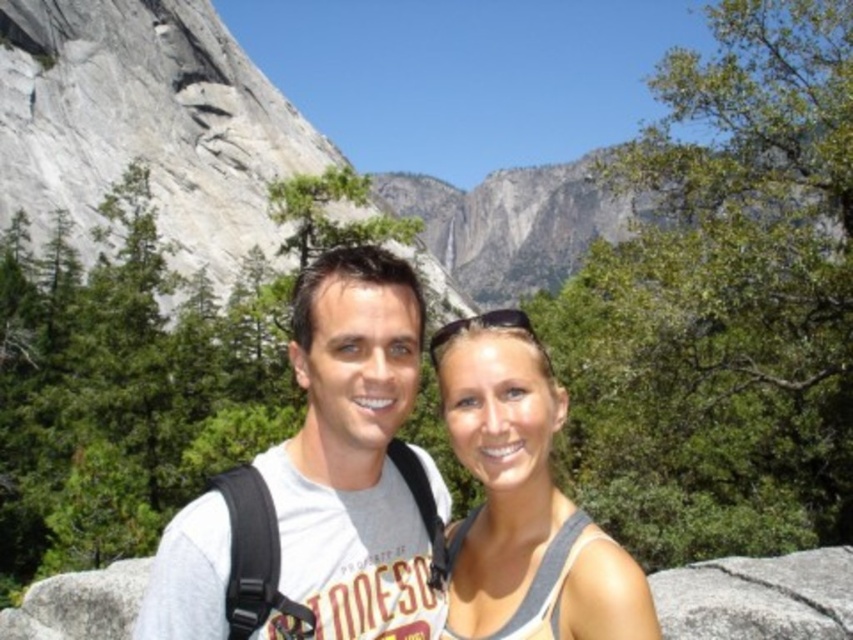
Question: Is gray granite mountain at upper left positioned before white cotton t-shirt at center?

Choices:
 (A) no
 (B) yes

Answer: (A)

Question: Among these points, which one is nearest to the camera?

Choices:
 (A) (173, 554)
 (B) (511, 456)

Answer: (A)

Question: Which point is closer to the camera?

Choices:
 (A) (509, 528)
 (B) (198, 554)

Answer: (B)

Question: Is white cotton t-shirt at center smaller than matte gray tank top at center?

Choices:
 (A) no
 (B) yes

Answer: (B)

Question: Which point appears closest to the camera in this image?

Choices:
 (A) (198, 636)
 (B) (283, 163)
 (C) (553, 544)

Answer: (A)

Question: Can you confirm if white cotton t-shirt at center is thinner than matte gray tank top at center?

Choices:
 (A) yes
 (B) no

Answer: (B)